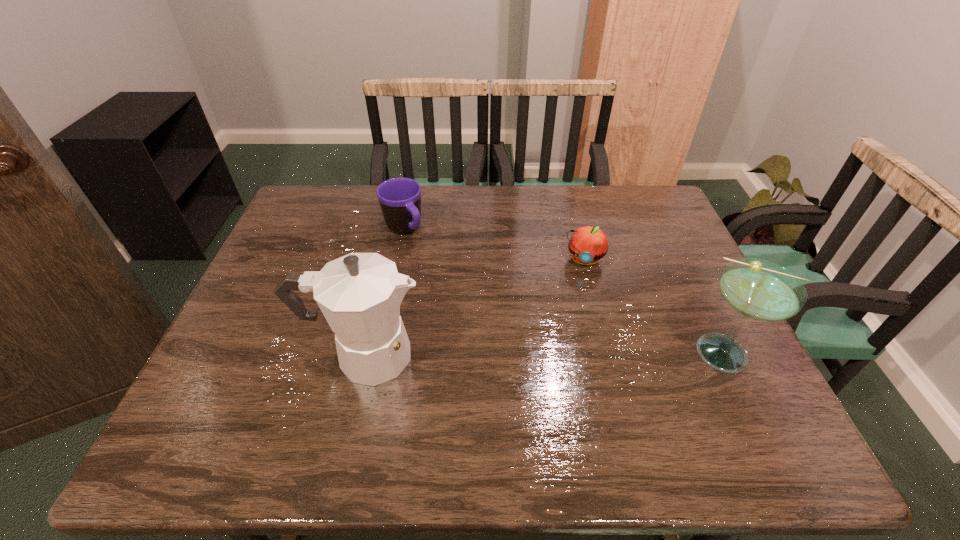
The width and height of the screenshot is (960, 540). Identify the location of the tallest object. (359, 294).

Where is `the second tallest object`? the second tallest object is located at coordinates (757, 289).

Where is `the rightmost object`? Image resolution: width=960 pixels, height=540 pixels. the rightmost object is located at coordinates (757, 289).

Where is `the third nearest object`? This screenshot has width=960, height=540. the third nearest object is located at coordinates (588, 244).

Where is `apple`? The width and height of the screenshot is (960, 540). apple is located at coordinates (588, 244).

What are the coordinates of `mug` in the screenshot? It's located at (400, 198).

Image resolution: width=960 pixels, height=540 pixels. Find the location of `free location located 0.090m at the spout of the tallest object`. free location located 0.090m at the spout of the tallest object is located at coordinates (464, 355).

Locate an element on the screen. The height and width of the screenshot is (540, 960). vacant space situated 0.290m on the left of the rightmost object is located at coordinates (565, 353).

Locate an element on the screen. The image size is (960, 540). vacant space located on the surface of the second farthest object is located at coordinates (559, 363).

In order to click on vacant space located 0.050m on the surface of the second farthest object in this screenshot , I will do `click(577, 284)`.